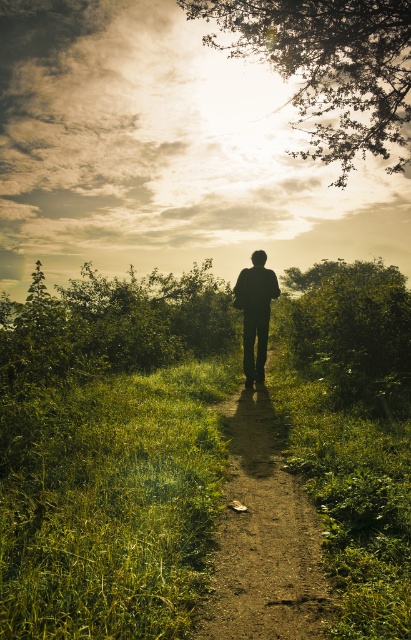
Between green leafy tree at center and silhouette figure at center, which one has more height?

With more height is green leafy tree at center.

Does green leafy tree at center have a larger size compared to silhouette figure at center?

Yes.

Find the location of a particular element. This screenshot has height=640, width=411. green leafy tree at center is located at coordinates (351, 332).

Is green leafy bush at left shorter than green leafy tree at center?

Yes.

Between green leafy bush at left and green leafy tree at center, which one has less height?

green leafy bush at left is shorter.

Between point (186, 284) and point (343, 362), which one is positioned in front?

Point (343, 362) is more forward.

What are the coordinates of `green leafy bush at left` in the screenshot? It's located at [113, 324].

Who is higher up, silvery metallic branches at upper center or green leafy tree at center?

silvery metallic branches at upper center is higher up.

Does silvery metallic branches at upper center have a larger size compared to green leafy tree at center?

Correct, silvery metallic branches at upper center is larger in size than green leafy tree at center.

Locate an element on the screen. The image size is (411, 640). silvery metallic branches at upper center is located at coordinates (328, 65).